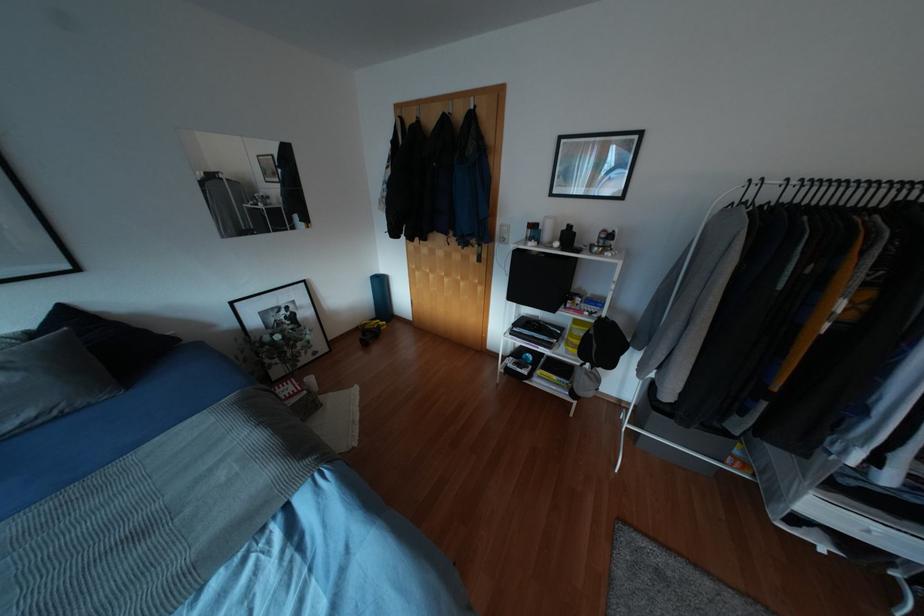
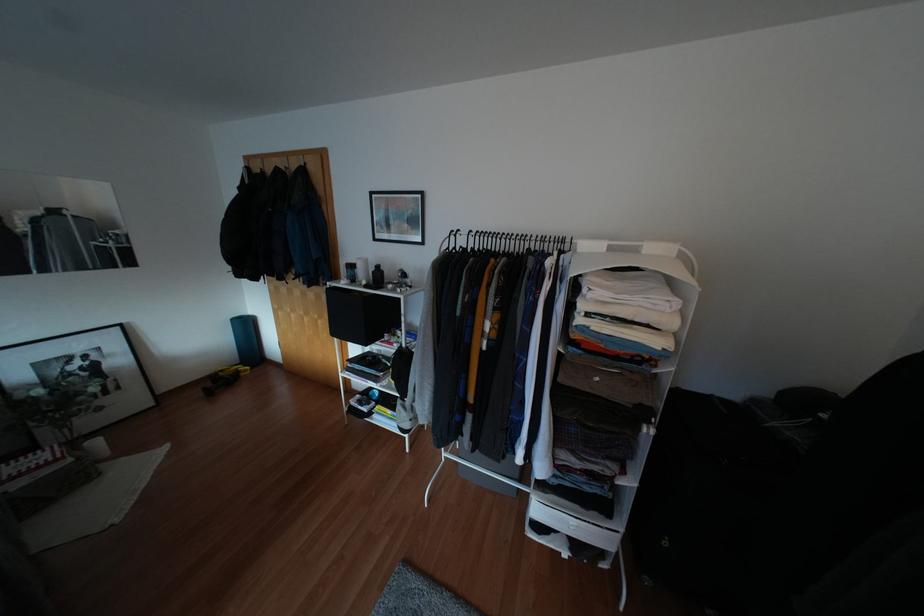
In the second image, find the point that corresponds to pixel 555 244 in the first image.

(362, 282)